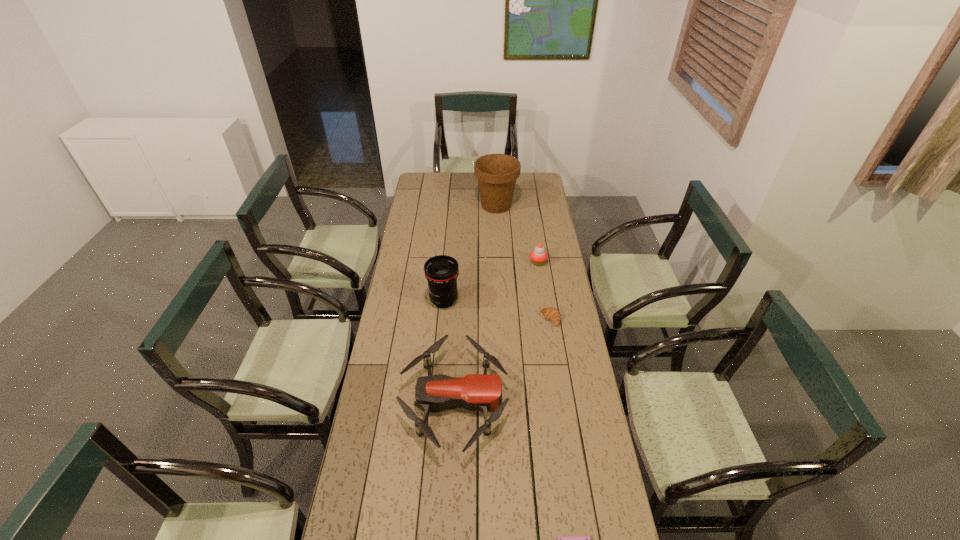
At what (x,y) coordinates should I click in order to perform the action: click on vacant area between the flowerpot and the telephoto lens. Please return your answer as a coordinate pair (x, y). The width and height of the screenshot is (960, 540). Looking at the image, I should click on (470, 253).

Locate an element on the screen. The image size is (960, 540). vacant area that lies between the second farthest object and the fifth tallest object is located at coordinates click(x=544, y=291).

You are a GUI agent. You are given a task and a screenshot of the screen. Output one action in this format:
    pyautogui.click(x=<x>, y=<y>)
    Task: Click on the free space between the fifth farthest object and the flowerpot
    This screenshot has width=960, height=540.
    Given the screenshot: What is the action you would take?
    point(475,303)

The width and height of the screenshot is (960, 540). Identify the location of vacant point located between the fifth farthest object and the cupcake. (496, 332).

Where is `free space between the fifth shortest object and the fifth tallest object`? The image size is (960, 540). free space between the fifth shortest object and the fifth tallest object is located at coordinates (497, 309).

You are a GUI agent. You are given a task and a screenshot of the screen. Output one action in this format:
    pyautogui.click(x=<x>, y=<y>)
    Task: Click on the vacant space that is in between the telephoto lens and the fifth farthest object
    This screenshot has height=540, width=960.
    Given the screenshot: What is the action you would take?
    click(449, 350)

Where is `object that stands as the fourth closest to the second nearest object`? The width and height of the screenshot is (960, 540). object that stands as the fourth closest to the second nearest object is located at coordinates (538, 256).

Locate which object ranks second in proximity to the cupcake. Please provide its 2D coordinates. Your answer should be formatted as a tuple, i.e. [(x, y)], where the tuple contains the x and y coordinates of a point satisfying the conditions above.

[(496, 173)]

Identify the location of free space that satisfies the following two spatial constraints: 1. on the back side of the fifth nearest object; 2. on the right side of the telephoto lens. (447, 262).

Find the location of a particular element. blank space that satisfies the following two spatial constraints: 1. on the front side of the cupcake; 2. on the right side of the crescent roll is located at coordinates (546, 319).